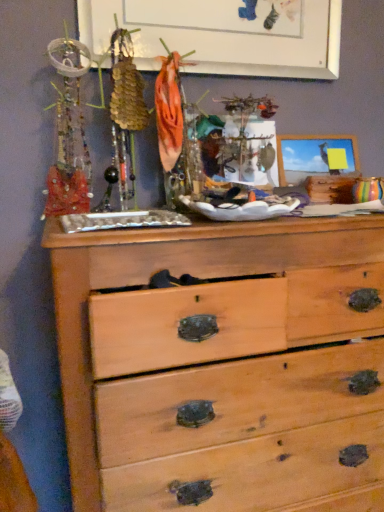
Question: From their relative heights in the image, would you say natural wood chest of drawers at center is taller or shorter than white matte bulletin board at upper center?

Choices:
 (A) tall
 (B) short

Answer: (A)

Question: From the image's perspective, is natural wood chest of drawers at center located above or below white matte bulletin board at upper center?

Choices:
 (A) below
 (B) above

Answer: (A)

Question: Is point (100, 245) closer or farther from the camera than point (261, 75)?

Choices:
 (A) farther
 (B) closer

Answer: (B)

Question: From the image's perspective, is white matte bulletin board at upper center above or below natural wood chest of drawers at center?

Choices:
 (A) below
 (B) above

Answer: (B)

Question: Considering their positions, is white matte bulletin board at upper center located in front of or behind natural wood chest of drawers at center?

Choices:
 (A) behind
 (B) front

Answer: (A)

Question: Considering the positions of point (147, 9) and point (87, 399), is point (147, 9) closer or farther from the camera than point (87, 399)?

Choices:
 (A) closer
 (B) farther

Answer: (B)

Question: From a real-world perspective, is white matte bulletin board at upper center physically located above or below natural wood chest of drawers at center?

Choices:
 (A) above
 (B) below

Answer: (A)